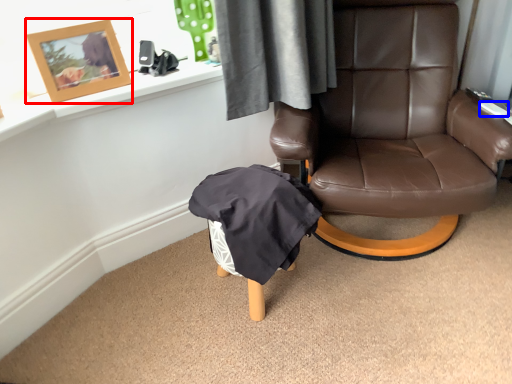
Question: Among these objects, which one is nearest to the camera, picture frame (highlighted by a red box) or remote control (highlighted by a blue box)?

Choices:
 (A) picture frame
 (B) remote control

Answer: (A)